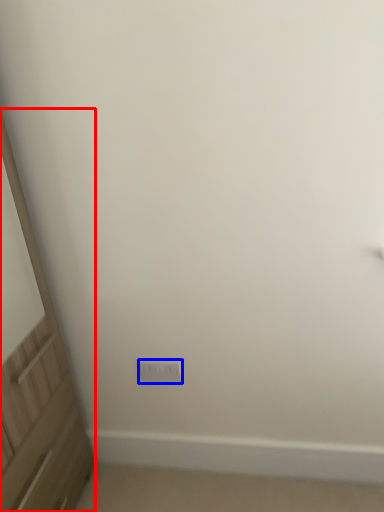
Question: Which point is closer to the camera, screen door (highlighted by a red box) or electric outlet (highlighted by a blue box)?

Choices:
 (A) screen door
 (B) electric outlet

Answer: (A)